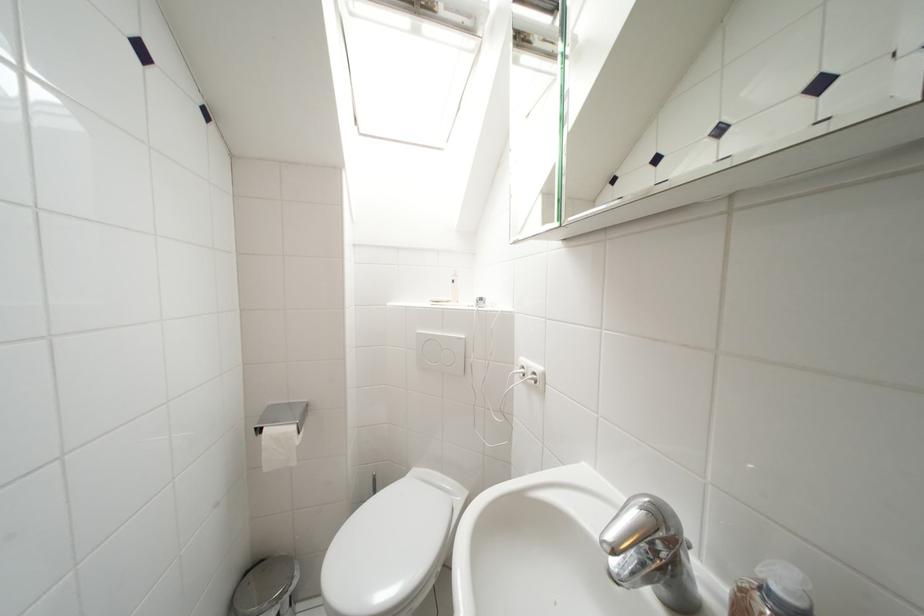
Where is `white toilet paper`? Image resolution: width=924 pixels, height=616 pixels. white toilet paper is located at coordinates (278, 446).